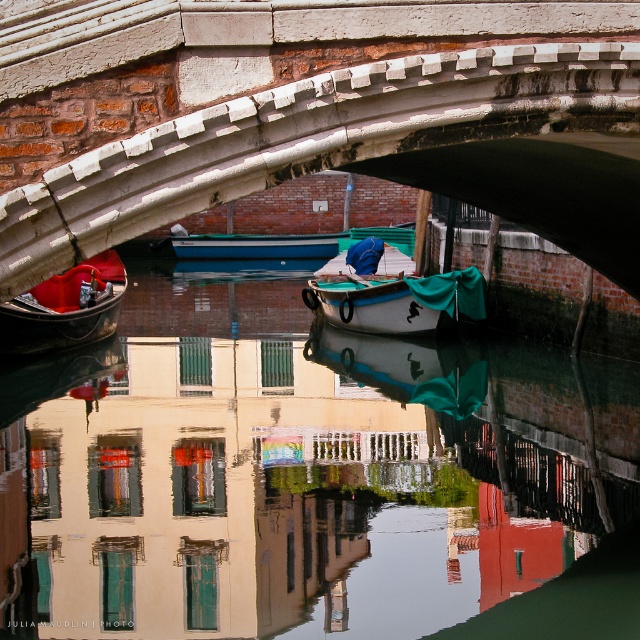
Consider the image. Can you confirm if matte black gondola at left is positioned to the right of blue glossy boat at center?

In fact, matte black gondola at left is to the left of blue glossy boat at center.

Does point (83, 298) come closer to viewer compared to point (209, 253)?

Yes, it is.

Find the location of `matte black gondola at left`. matte black gondola at left is located at coordinates (65, 307).

Is point (362, 634) behind point (93, 332)?

No.

You are a GUI agent. You are given a task and a screenshot of the screen. Output one action in this format:
    pyautogui.click(x=<x>, y=<y>)
    Task: Click on the transparent water at center
    The image size is (640, 640).
    Given the screenshot: What is the action you would take?
    pyautogui.click(x=305, y=477)

Who is more forward, (458,182) or (248,236)?

Point (458,182)

Is white stone arch bridge at center taller than blue glossy boat at center?

Correct, white stone arch bridge at center is much taller as blue glossy boat at center.

Where is `white stone arch bridge at center`? Image resolution: width=640 pixels, height=640 pixels. white stone arch bridge at center is located at coordinates (371, 152).